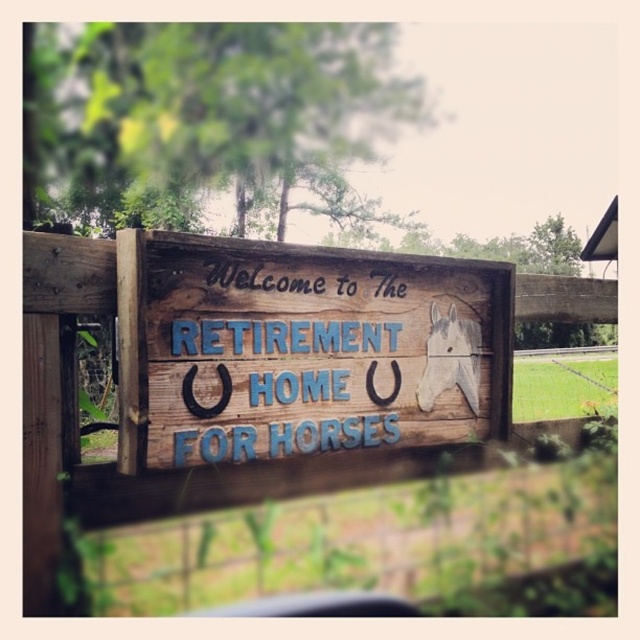
Can you confirm if wooden sign at center is taller than white painted wood horse at center?

Yes.

Is point (125, 259) positioned behind point (458, 353)?

No, (125, 259) is in front of (458, 353).

Does point (108, 301) lie in front of point (440, 344)?

Yes.

Identify the location of wooden sign at center. This screenshot has height=640, width=640. (248, 374).

Is weathered wood sign at center taller than white painted wood horse at center?

Indeed, weathered wood sign at center has a greater height compared to white painted wood horse at center.

Who is more forward, (300, 362) or (429, 380)?

Point (300, 362)

Image resolution: width=640 pixels, height=640 pixels. I want to click on weathered wood sign at center, so click(301, 349).

Image resolution: width=640 pixels, height=640 pixels. I want to click on weathered wood sign at center, so click(x=301, y=349).

Does wooden sign at center appear on the left side of weathered wood sign at center?

In fact, wooden sign at center is to the right of weathered wood sign at center.

Is point (182, 252) closer to viewer compared to point (412, 369)?

That is True.

Locate an element on the screen. wooden sign at center is located at coordinates (248, 374).